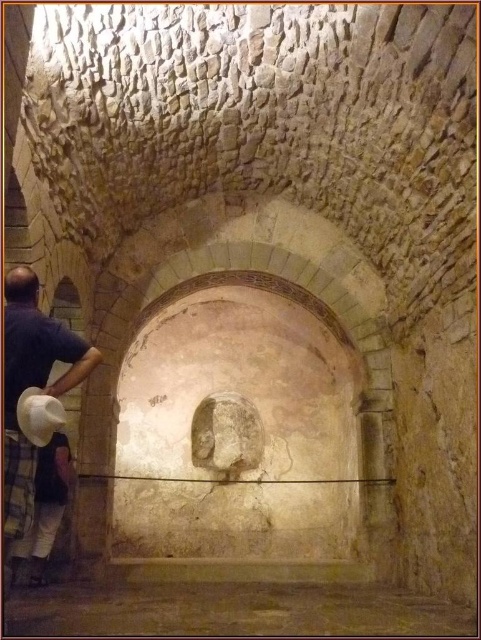
You are standing in the historical interior and want to place a small decorative item between the two points, point [8,358] and point [35,401]. Which point should you start placing the item closer to to ensure it is nearer to the camera?

You should start placing the item closer to point [8,358] because it is further to the camera than point [35,401].

You are standing in the ancient chamber and want to place your white fabric hat at left on the smooth stone wall at center. Is the wall within reach from where you are standing?

The smooth stone wall at center is to the right of white fabric hat at left, so the wall is positioned to the right of where you are standing. Since the wall is adjacent to your current position, it should be within reach.

Looking at this image, you are an interior designer planning to hang a decorative item on the wall. Given the smooth stone wall at center and the white felt cowboy hat at lower left, which object would be more suitable for hanging a heavy item?

The smooth stone wall at center is positioned under the white felt cowboy hat at lower left, making it a more stable surface for hanging heavy items as it is structurally lower and can support weight better.